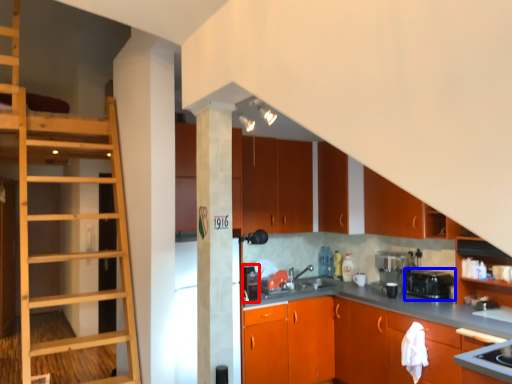
Question: Which of the following is the farthest to the observer, appliance (highlighted by a red box) or appliance (highlighted by a blue box)?

Choices:
 (A) appliance
 (B) appliance

Answer: (A)